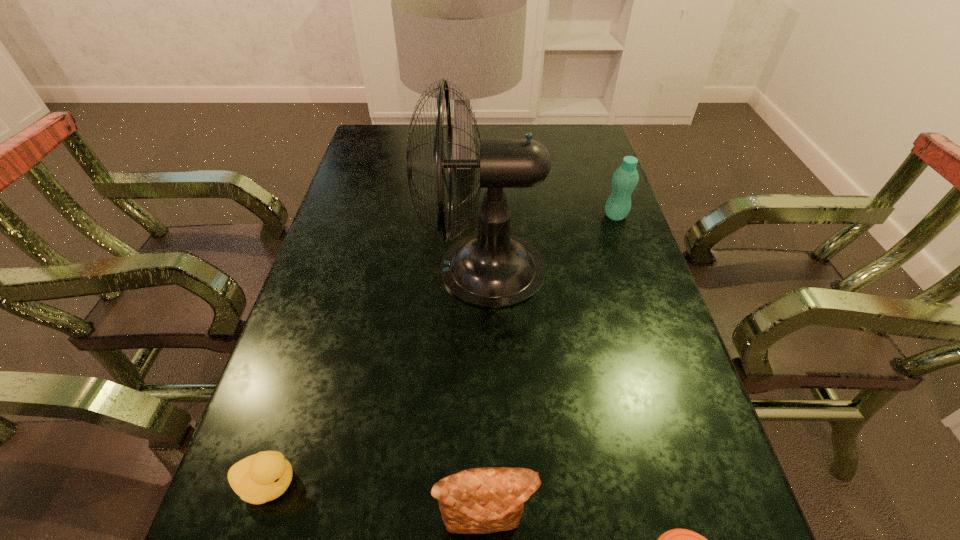
I want to click on vacant region located on the front-facing side of the duck, so tap(512, 483).

The height and width of the screenshot is (540, 960). What are the coordinates of `object that is at the far edge` in the screenshot? It's located at (459, 0).

At what (x,y) coordinates should I click in order to perform the action: click on object at the left edge. Please return your answer as a coordinate pair (x, y). The width and height of the screenshot is (960, 540). Looking at the image, I should click on (262, 477).

Find the location of `object located in the right edge section of the desktop`. object located in the right edge section of the desktop is located at coordinates (625, 179).

Find the location of a particular element. The width and height of the screenshot is (960, 540). vacant space at the left edge of the desktop is located at coordinates (342, 188).

Identify the location of vacant region at the right edge of the desktop. The width and height of the screenshot is (960, 540). (582, 266).

Locate an element on the screen. The width and height of the screenshot is (960, 540). free space at the far left corner is located at coordinates [372, 154].

Find the location of a particular element. This screenshot has width=960, height=540. empty space between the farthest object and the fan is located at coordinates (474, 216).

The image size is (960, 540). What are the coordinates of `vacant region between the lampshade and the third farthest object` in the screenshot? It's located at (474, 216).

At what (x,y) coordinates should I click in order to perform the action: click on object that can be found as the fourth closest to the leftmost object. Please return your answer as a coordinate pair (x, y). Looking at the image, I should click on (459, 0).